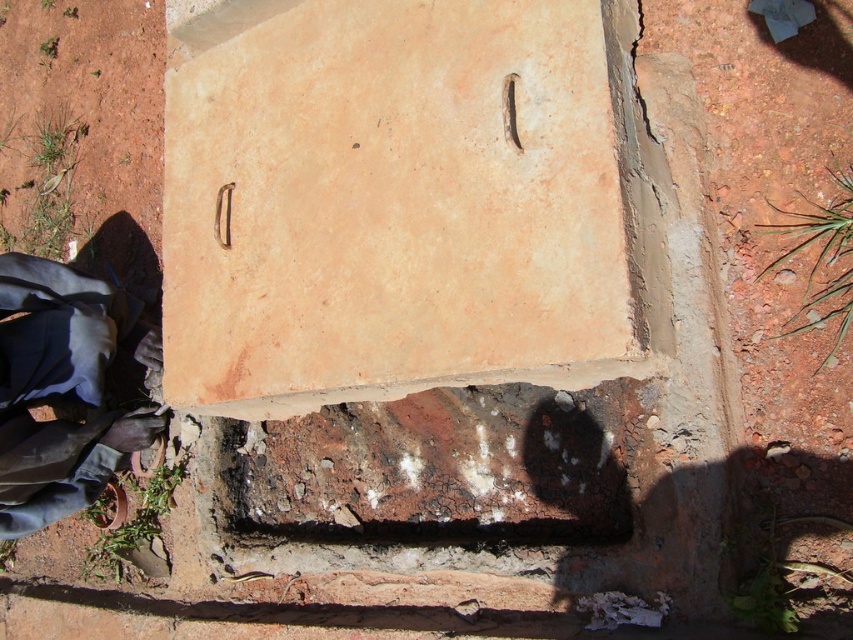
You are an interior designer assessing a room with a wall featuring a matte clay brick at center and a dark blue fabric at lower left. Which object occupies more vertical space on the wall?

The matte clay brick at center has a greater height compared to the dark blue fabric at lower left, so it occupies more vertical space on the wall.

You are an interior designer assessing the wall. You need to place a decorative item on the matte clay brick at center and hang a picture on the dark blue fabric at lower left. Can you do both tasks without moving either object?

The matte clay brick at center is above the dark blue fabric at lower left, so placing the decorative item on the matte clay brick at center and hanging the picture on the dark blue fabric at lower left is possible without moving either object as they are positioned at different vertical levels.

You are a painter standing at the base of the wall. You need to reach both the matte clay brick at center and the dark blue fabric at lower left. Given that your ladder can extend up to 28 inches, will you be able to reach both objects without moving the ladder?

The matte clay brick at center is 29.33 inches away from the dark blue fabric at lower left. Since the ladder can only extend up to 28 inches, you won